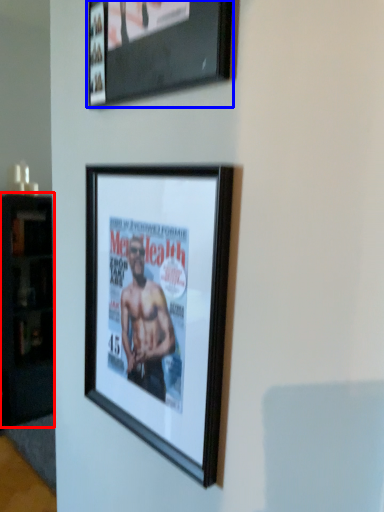
Question: Which of the following is the farthest to the observer, cabinetry (highlighted by a red box) or picture frame (highlighted by a blue box)?

Choices:
 (A) cabinetry
 (B) picture frame

Answer: (A)